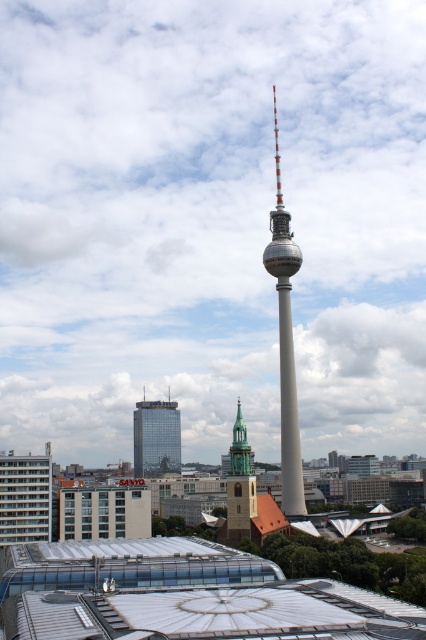
You are a drone operator trying to capture aerial shots of Berlin landmarks. You have two points marked on your map for camera positioning. The first point is at coordinates point (268,586), and the second is at point (290,442). Based on the scene, which point would give you a better view of the Fernsehturm? Explain your reasoning.

Point (268,586) is in front of point (290,442). Therefore, positioning the drone at point (268,586) would provide a clearer and less obstructed view of the Fernsehturm since it is closer to the tower and not blocked by structures behind it.

You are a tourist in Berlin and want to take a photo of the smooth gray tower at center and the glassy reflective skyscraper at center. Which object should you focus on first if you want to capture both in a single frame without moving the camera?

The smooth gray tower at center is positioned over the glassy reflective skyscraper at center, so you should focus on the smooth gray tower at center first to ensure both are in the frame.

You are a drone operator trying to capture the smooth gray tower at center from above. Given the coordinates provided in the Objects Description, can you confirm if the tower is positioned centrally in the image?

The smooth gray tower at center is located at point coordinates, which indicates it is positioned centrally in the image as per the given coordinates.